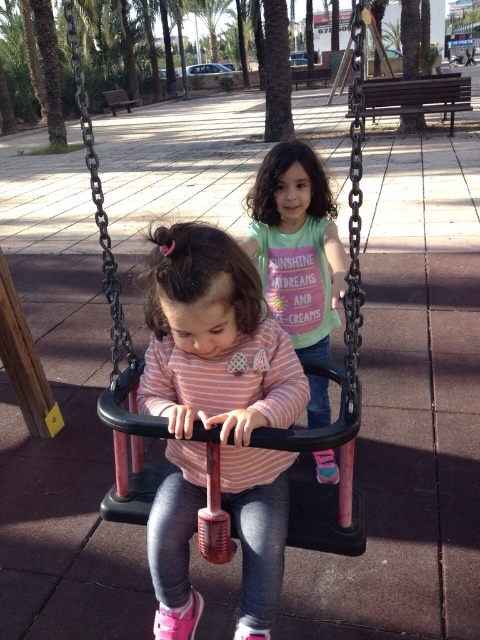
Question: Can you confirm if black plastic swing at center is thinner than matte pink shirt at center?

Choices:
 (A) no
 (B) yes

Answer: (A)

Question: Is black plastic swing at center smaller than matte pink shirt at center?

Choices:
 (A) no
 (B) yes

Answer: (A)

Question: Which point is farther from the camera taking this photo?

Choices:
 (A) (338, 417)
 (B) (280, 237)
 (C) (220, 428)

Answer: (B)

Question: Estimate the real-world distances between objects in this image. Which object is farther from the black plastic swing at center?

Choices:
 (A) pink striped shirt at center
 (B) matte pink shirt at center

Answer: (B)

Question: Which of the following is the farthest from the observer?

Choices:
 (A) [134, 480]
 (B) [197, 502]

Answer: (A)

Question: Does pink striped shirt at center have a larger size compared to black plastic swing at center?

Choices:
 (A) yes
 (B) no

Answer: (B)